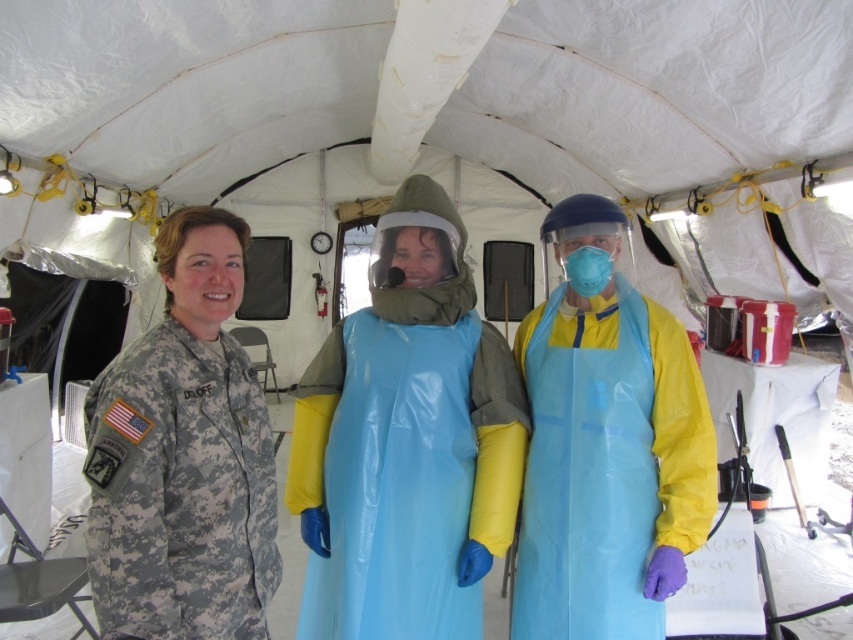
Question: Can you confirm if camouflage uniform at left is positioned to the left of blue plastic apron at center?

Choices:
 (A) no
 (B) yes

Answer: (B)

Question: Estimate the real-world distances between objects in this image. Which object is farther from the blue matte face mask at center?

Choices:
 (A) blue plastic gown at center
 (B) camouflage uniform at left

Answer: (B)

Question: In this image, where is blue plastic gown at center located relative to blue matte face mask at center?

Choices:
 (A) below
 (B) above

Answer: (A)

Question: Which point is farther to the camera?

Choices:
 (A) blue matte face mask at center
 (B) blue plastic gown at center
 (C) blue plastic apron at center

Answer: (A)

Question: Which point is farther to the camera?

Choices:
 (A) blue plastic apron at center
 (B) camouflage uniform at left

Answer: (A)

Question: Is blue plastic gown at center positioned at the back of camouflage uniform at left?

Choices:
 (A) yes
 (B) no

Answer: (A)